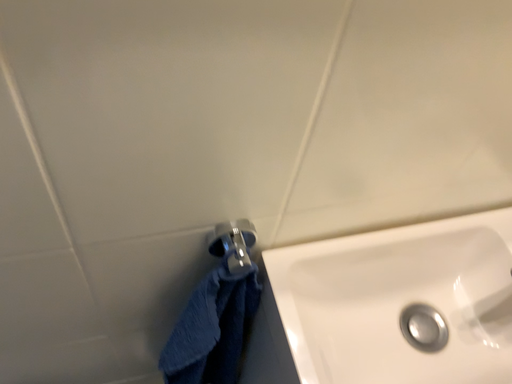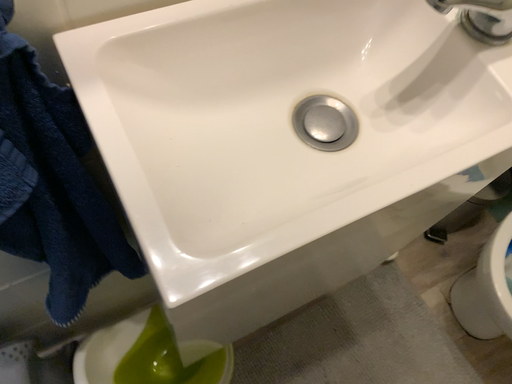
Question: How did the camera likely rotate when shooting the video?

Choices:
 (A) rotated downward
 (B) rotated upward

Answer: (A)